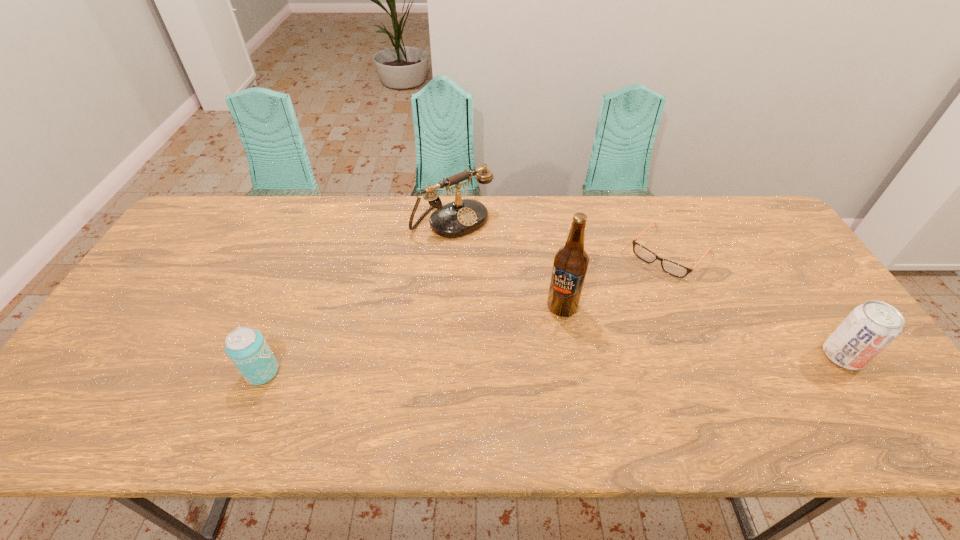
At what (x,y) coordinates should I click in order to perform the action: click on vacant space located on the front-facing side of the shortest object. Please return your answer as a coordinate pair (x, y). Looking at the image, I should click on (634, 293).

The image size is (960, 540). What are the coordinates of `free point located 0.370m on the front-facing side of the shortest object` in the screenshot? It's located at (579, 352).

Identify the location of vacant area situated 0.100m on the front-facing side of the shortest object. 634,293.

The height and width of the screenshot is (540, 960). Find the location of `vacant space located on the dial of the fourth object from right to left`. vacant space located on the dial of the fourth object from right to left is located at coordinates (555, 309).

Find the location of a particular element. This screenshot has height=540, width=960. free location located 0.350m on the dial of the fourth object from right to left is located at coordinates (550, 304).

This screenshot has height=540, width=960. Find the location of `vacant space located on the dial of the fourth object from right to left`. vacant space located on the dial of the fourth object from right to left is located at coordinates (527, 282).

Locate an element on the screen. free space located 0.170m on the label of the beer bottle is located at coordinates (515, 357).

This screenshot has height=540, width=960. Find the location of `free space located 0.270m on the label of the beer bottle`. free space located 0.270m on the label of the beer bottle is located at coordinates (489, 384).

Identify the location of vacant space situated 0.060m on the label of the beer bottle. (540, 330).

Locate an element on the screen. This screenshot has width=960, height=540. spectacles that is at the far edge is located at coordinates 670,267.